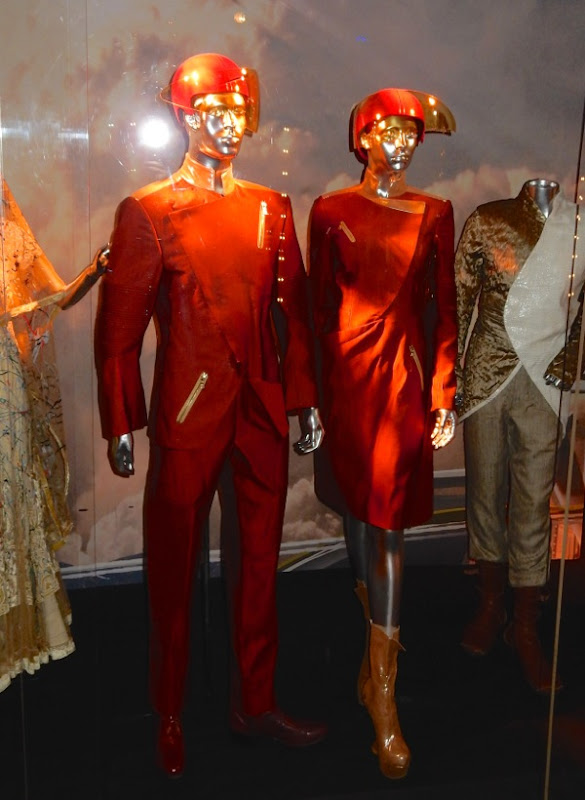
I want to click on wall, so click(x=89, y=172).